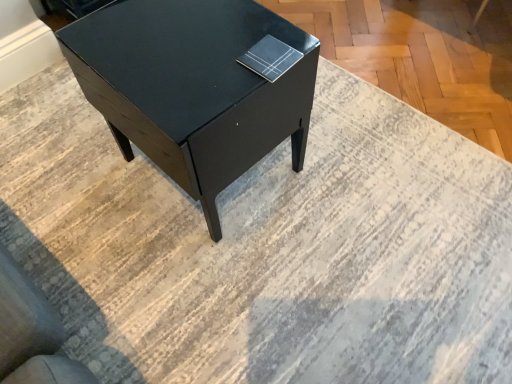
Describe the element at coordinates (197, 86) in the screenshot. I see `matte black table at center` at that location.

Where is `matte black table at center`? Image resolution: width=512 pixels, height=384 pixels. matte black table at center is located at coordinates (197, 86).

The image size is (512, 384). What do you see at coordinates (270, 58) in the screenshot?
I see `matte black book at upper right` at bounding box center [270, 58].

Consider the image. In order to face matte black book at upper right, should I rotate leftwards or rightwards?

A 2.073 degree turn to the right will do.

Identify the location of matte black book at upper right. The height and width of the screenshot is (384, 512). (270, 58).

Locate an element on the screen. matte black table at center is located at coordinates point(197,86).

Which is more to the right, matte black book at upper right or matte black table at center?

From the viewer's perspective, matte black book at upper right appears more on the right side.

Is the position of matte black book at upper right more distant than that of matte black table at center?

Yes, matte black book at upper right is behind matte black table at center.

Consider the image. Which is closer, (288, 49) or (255, 90)?

Positioned in front is point (255, 90).

From the image's perspective, is matte black book at upper right under matte black table at center?

No.

From a real-world perspective, is matte black book at upper right physically located above or below matte black table at center?

From a real-world perspective, matte black book at upper right is physically above matte black table at center.

Considering the sizes of matte black book at upper right and matte black table at center in the image, is matte black book at upper right wider or thinner than matte black table at center?

Clearly, matte black book at upper right has less width compared to matte black table at center.

Looking at this image, considering the sizes of matte black book at upper right and matte black table at center in the image, is matte black book at upper right taller or shorter than matte black table at center?

matte black book at upper right is shorter than matte black table at center.

Considering the sizes of objects matte black book at upper right and matte black table at center in the image provided, who is bigger, matte black book at upper right or matte black table at center?

matte black table at center is bigger.

Is matte black book at upper right positioned beyond the bounds of matte black table at center?

matte black book at upper right is positioned outside matte black table at center.

Are matte black book at upper right and matte black table at center located far from each other?

No, matte black book at upper right is not far from matte black table at center.

Is matte black book at upper right oriented away from matte black table at center?

matte black book at upper right does not have its back to matte black table at center.

Can you tell me how much matte black book at upper right and matte black table at center differ in facing direction?

There is a 10-degree angle between the facing directions of matte black book at upper right and matte black table at center.

The width and height of the screenshot is (512, 384). What are the coordinates of `table lying in front of the matte black book at upper right` in the screenshot? It's located at (197, 86).

Considering the relative positions of matte black table at center and matte black book at upper right in the image provided, is matte black table at center to the left or to the right of matte black book at upper right?

From the image, it's evident that matte black table at center is to the left of matte black book at upper right.

Between matte black table at center and matte black book at upper right, which one is positioned behind?

matte black book at upper right is more distant.

Which is further, (258, 159) or (298, 53)?

The point (258, 159) is farther from the camera.

From the image's perspective, which is below, matte black table at center or matte black book at upper right?

matte black table at center, from the image's perspective.

From a real-world perspective, is matte black table at center positioned over matte black book at upper right based on gravity?

Incorrect, from a real-world perspective, matte black table at center is lower than matte black book at upper right.

Considering the relative sizes of matte black table at center and matte black book at upper right in the image provided, is matte black table at center thinner than matte black book at upper right?

No.

Who is shorter, matte black table at center or matte black book at upper right?

Standing shorter between the two is matte black book at upper right.

Does matte black table at center have a larger size compared to matte black book at upper right?

Correct, matte black table at center is larger in size than matte black book at upper right.

Is matte black table at center completely or partially outside of matte black book at upper right?

Yes.

Is matte black table at center not close to matte black book at upper right?

No, matte black table at center is in close proximity to matte black book at upper right.

Is matte black table at center oriented away from matte black book at upper right?

No, matte black table at center is not facing away from matte black book at upper right.

What's the angular difference between matte black table at center and matte black book at upper right's facing directions?

10 degrees.

Image resolution: width=512 pixels, height=384 pixels. I want to click on table that is in front of the matte black book at upper right, so click(x=197, y=86).

Where is `table that is under the matte black book at upper right (from a real-world perspective)`? This screenshot has width=512, height=384. table that is under the matte black book at upper right (from a real-world perspective) is located at coordinates (197, 86).

Where is `book lying on the right of matte black table at center`? book lying on the right of matte black table at center is located at coordinates (270, 58).